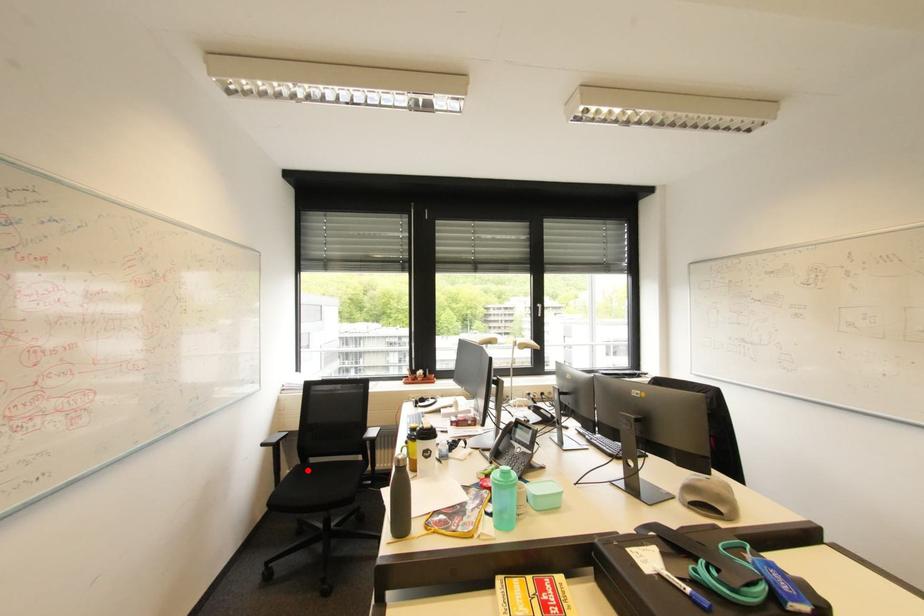
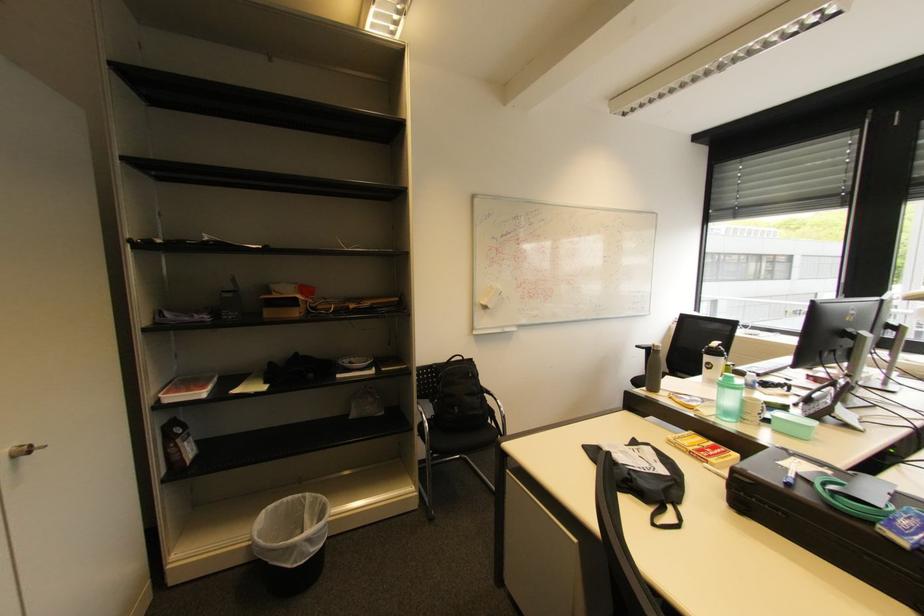
Question: I am providing you with two images of the same scene from different viewpoints. A red point is marked on the first image. Is the red point's position out of view in image 2?

Choices:
 (A) Yes
 (B) No

Answer: (A)